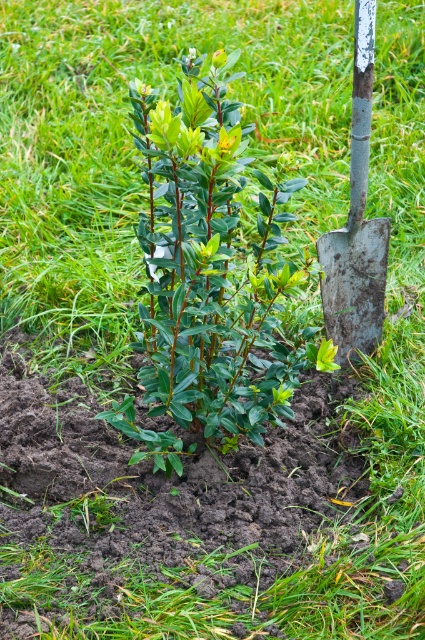
You are a gardener who just finished planting a shrub. You need to move the rusty metal shovel at right to a storage shed located 10 feet away from the green glossy bush at center. Can you carry the shovel directly to the shed without moving the bush?

The distance between the green glossy bush at center and the rusty metal shovel at right is 20.33 inches. Since the shed is 10 feet away from the bush, which is much farther than the shovel is from the bush, you can easily carry the shovel directly to the shed without needing to move the bush.

You are a gardener who needs to move the rusty metal shovel at right to another location. The green glossy bush at center is in the way. Can you move the shovel without damaging the bush?

The green glossy bush at center is bigger than the rusty metal shovel at right, so it is possible to move the shovel around the bush without damaging it.

You are a gardener who needs to place a decorative stone exactly at the center of the green glossy bush at center. According to the coordinates provided, where should you place the stone?

The green glossy bush at center is located at point (x=210, y=266), so you should place the decorative stone at those coordinates to mark its center.